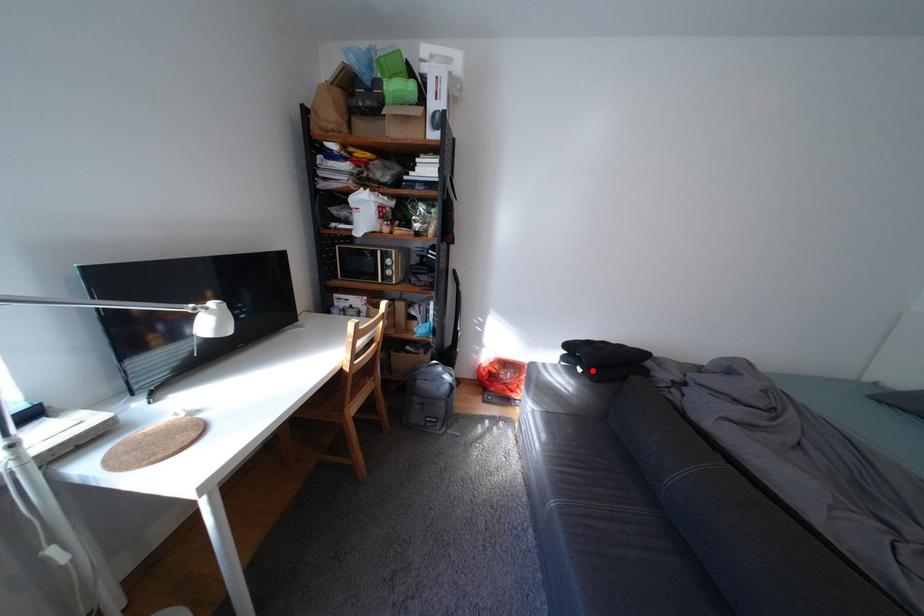
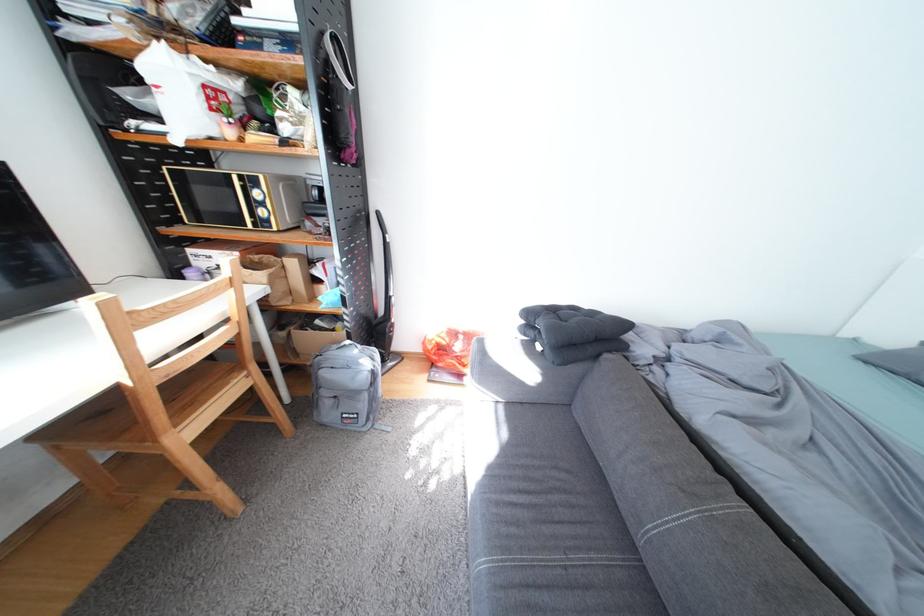
Locate, in the second image, the point that corresponds to the highlighted location in the first image.

(552, 347)